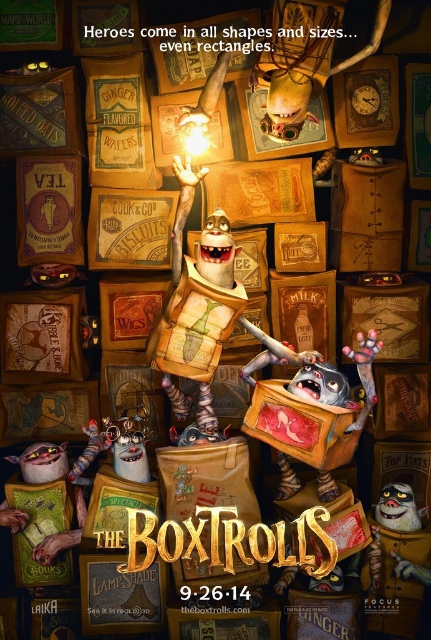
You are a character in the movie who needs to retrieve an item from the wooden book at center and the shiny metallic toy at bottom right. Which object is easier to reach?

The wooden book at center is closer to the viewer than the shiny metallic toy at bottom right, so it is easier to reach.

Looking at the movie poster for The Boxtrolls, you see a shiny metallic toy at center and a fluffy white pillow at lower left. Which object is positioned to the right of the other?

The shiny metallic toy at center is to the right of the fluffy white pillow at lower left.

You are a character in the movie and need to move from point A to point B. If point A is at coordinate point (149,356) and point B is at coordinate point (43,564), which point is closer to the camera?

Point A at coordinate point (149,356) is closer to the camera than point B at coordinate point (43,564) because the description states that point A is further to the camera than point B is further to the viewer. Wait, there might be confusion here. Let me check the description again. The Objects Description says, Point (149,356) is further to the camera than point (43,564). So the answer should be that point A is further away from the camera, so point B is closer. Hmm, the user might have made